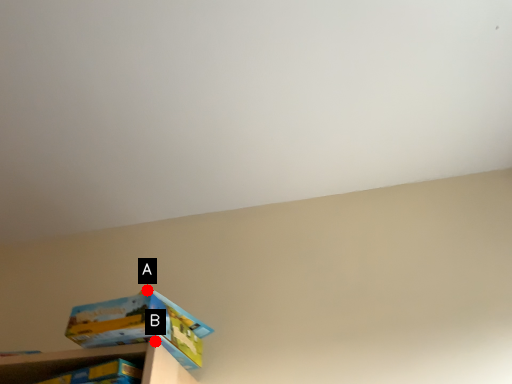
Question: Two points are circled on the image, labeled by A and B beside each circle. Which point is farther from the camera taking this photo?

Choices:
 (A) A is further
 (B) B is further

Answer: (A)